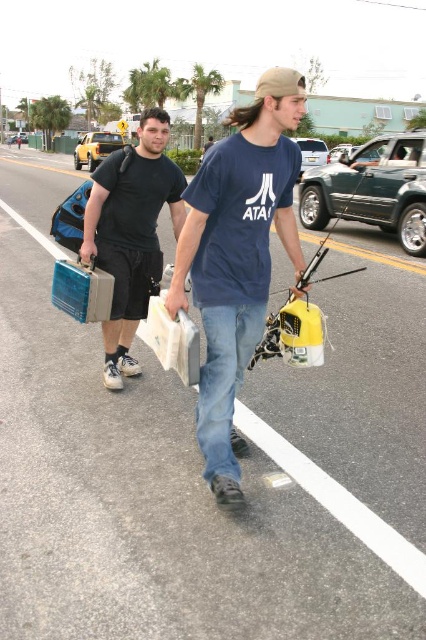
Image resolution: width=426 pixels, height=640 pixels. What do you see at coordinates (238, 257) in the screenshot?
I see `matte blue shirt at center` at bounding box center [238, 257].

Which of these two, matte blue shirt at center or matte black t-shirt at center, stands shorter?

matte black t-shirt at center is shorter.

Is point (213, 208) positioned before point (141, 296)?

Yes, point (213, 208) is in front of point (141, 296).

The height and width of the screenshot is (640, 426). In order to click on matte blue shirt at center in this screenshot , I will do `click(238, 257)`.